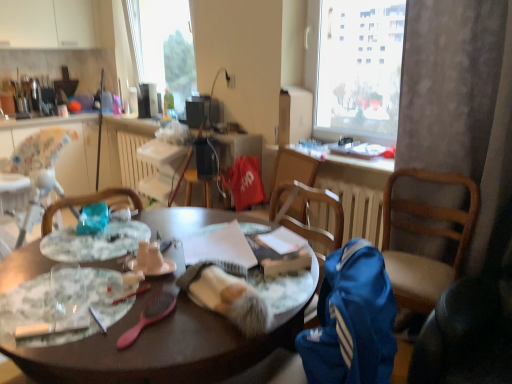
Identify the location of free location above marble-patterned plate at center-left, the first plate when ordered from front to back (from a real-world perspective). This screenshot has height=384, width=512. (67, 297).